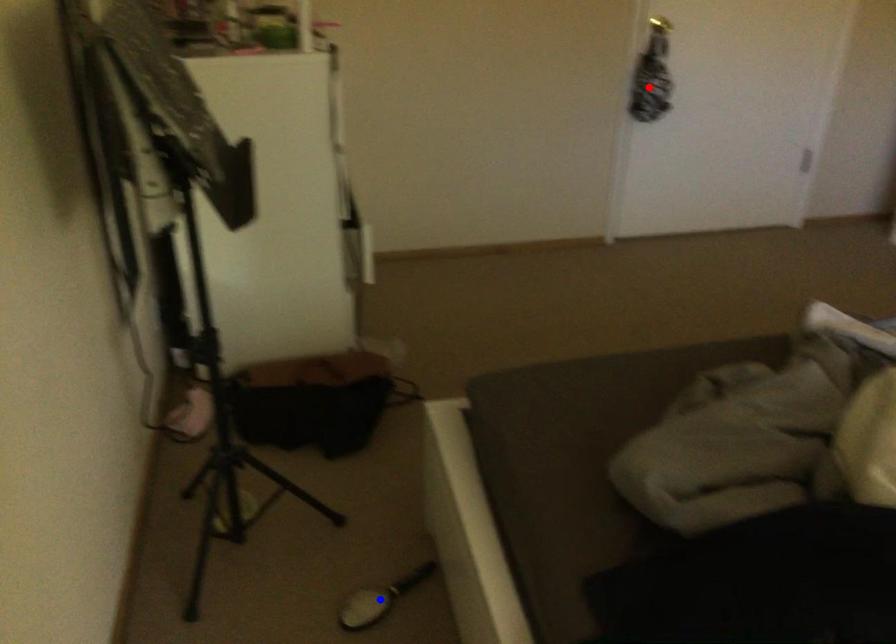
Question: Which of the two points in the image is closer to the camera?

Choices:
 (A) Blue point is closer.
 (B) Red point is closer.

Answer: (A)